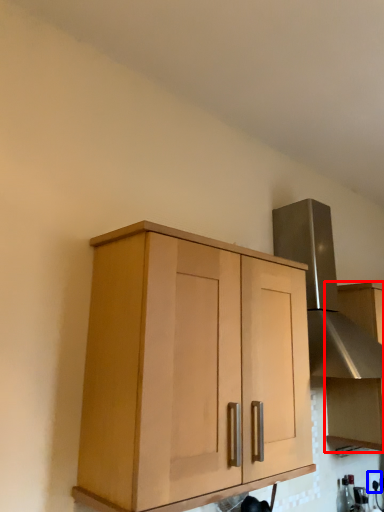
Question: Which of the following is the closest to the observer, cabinetry (highlighted by a red box) or electric outlet (highlighted by a blue box)?

Choices:
 (A) cabinetry
 (B) electric outlet

Answer: (A)